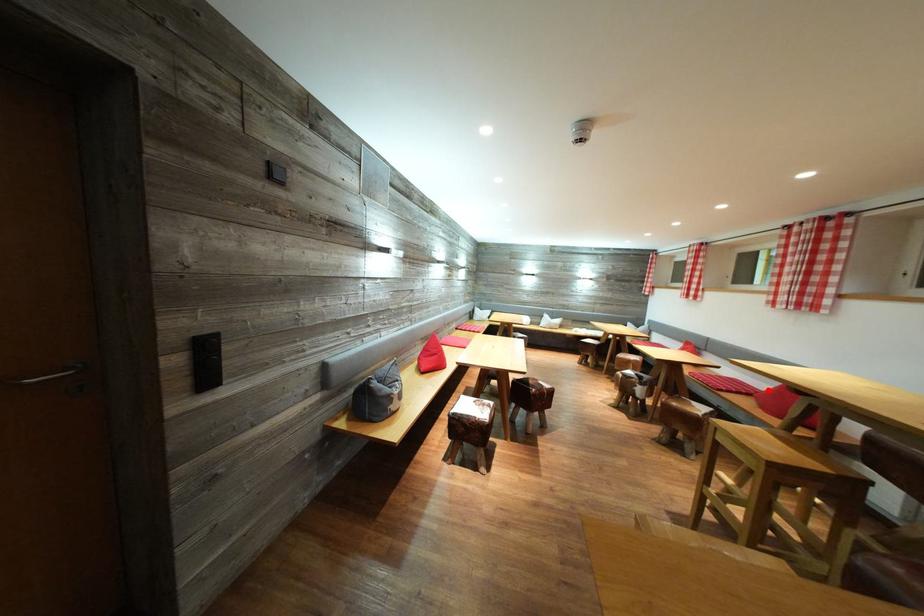
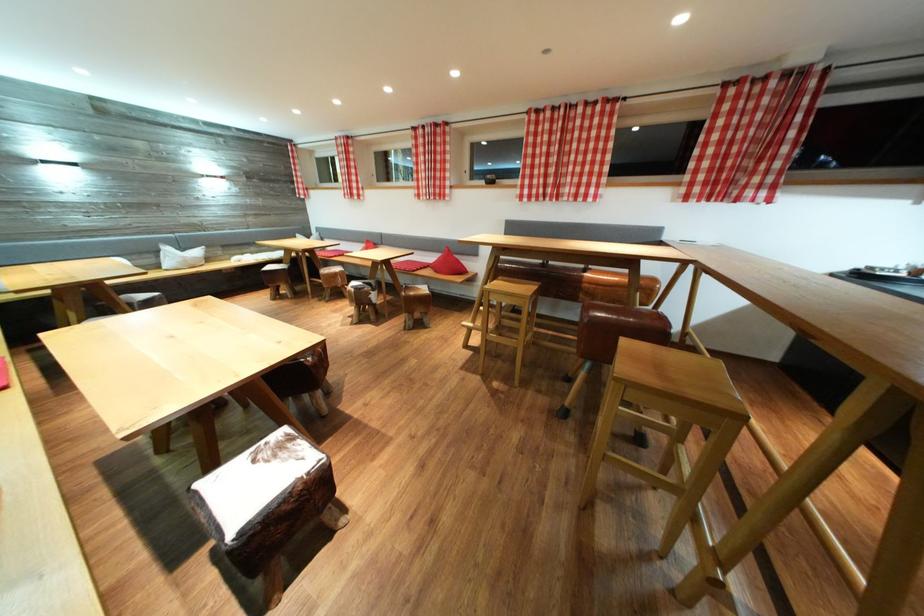
The point at the highlighted location is marked in the first image. Where is the corresponding point in the second image?

(438, 262)